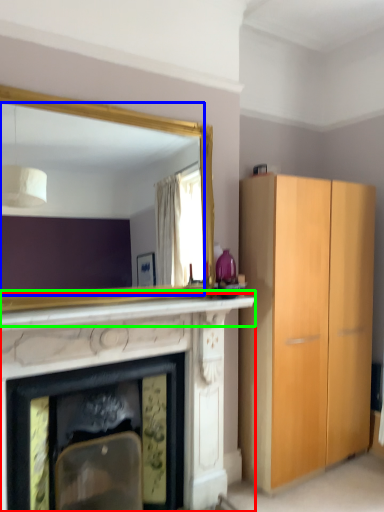
Question: Considering the real-world distances, which object is farthest from fireplace (highlighted by a red box)? mirror (highlighted by a blue box) or mantle (highlighted by a green box)?

Choices:
 (A) mirror
 (B) mantle

Answer: (A)